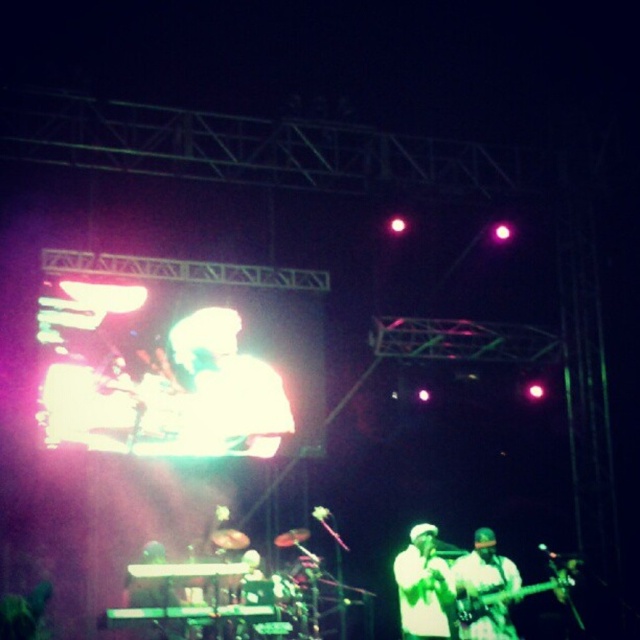
Does white matte guitar at lower right appear on the right side of metallic guitar at lower right?

No, white matte guitar at lower right is not to the right of metallic guitar at lower right.

Does white matte guitar at lower right have a smaller size compared to metallic guitar at lower right?

No, white matte guitar at lower right is not smaller than metallic guitar at lower right.

Is point (490, 621) behind point (464, 602)?

Yes, point (490, 621) is farther from viewer.

Find the location of a particular element. This screenshot has width=640, height=640. white matte guitar at lower right is located at coordinates (484, 589).

Does white matte shirt at center appear on the right side of metallic guitar at lower right?

In fact, white matte shirt at center is to the left of metallic guitar at lower right.

Between white matte shirt at center and metallic guitar at lower right, which one has less height?

Standing shorter between the two is metallic guitar at lower right.

At what (x,y) coordinates should I click in order to perform the action: click on white matte shirt at center. Please return your answer as a coordinate pair (x, y). The image size is (640, 640). Looking at the image, I should click on (422, 586).

Can you confirm if white matte shirt at center is positioned below white matte guitar at lower right?

Yes.

Between point (396, 557) and point (504, 609), which one is positioned behind?

The point (396, 557) is behind.

You are a GUI agent. You are given a task and a screenshot of the screen. Output one action in this format:
    pyautogui.click(x=<x>, y=<y>)
    Task: Click on the white matte shirt at center
    Image resolution: width=640 pixels, height=640 pixels.
    Given the screenshot: What is the action you would take?
    pyautogui.click(x=422, y=586)

Locate an element on the screen. This screenshot has height=640, width=640. white matte shirt at center is located at coordinates (422, 586).